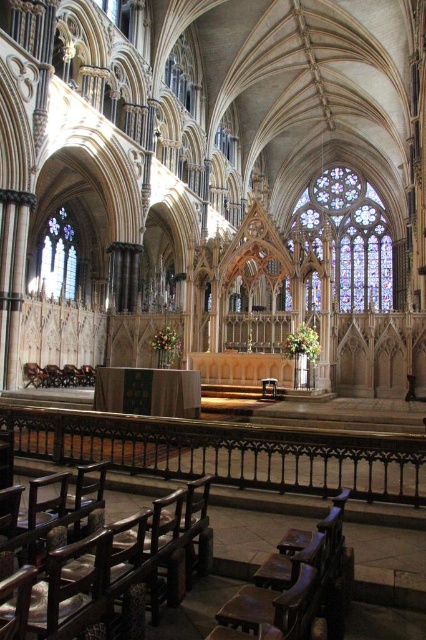
Question: Among these points, which one is farthest from the camera?

Choices:
 (A) (365, 304)
 (B) (48, 592)

Answer: (A)

Question: Is dark brown wood chair at lower left thinner than stained glass at upper right?

Choices:
 (A) no
 (B) yes

Answer: (B)

Question: Which point is farther from the camera taking this photo?

Choices:
 (A) (42, 250)
 (B) (380, 273)
 (C) (279, 620)

Answer: (B)

Question: Can you confirm if dark brown wood chair at lower left is positioned to the left of wooden polished chair at lower center?

Choices:
 (A) no
 (B) yes

Answer: (B)

Question: Which object is the farthest from the wooden polished chair at lower center?

Choices:
 (A) stained glass at upper right
 (B) clear glass window at left
 (C) dark brown wood chair at lower left

Answer: (A)

Question: Does stained glass at upper right have a lesser width compared to clear glass window at left?

Choices:
 (A) no
 (B) yes

Answer: (A)